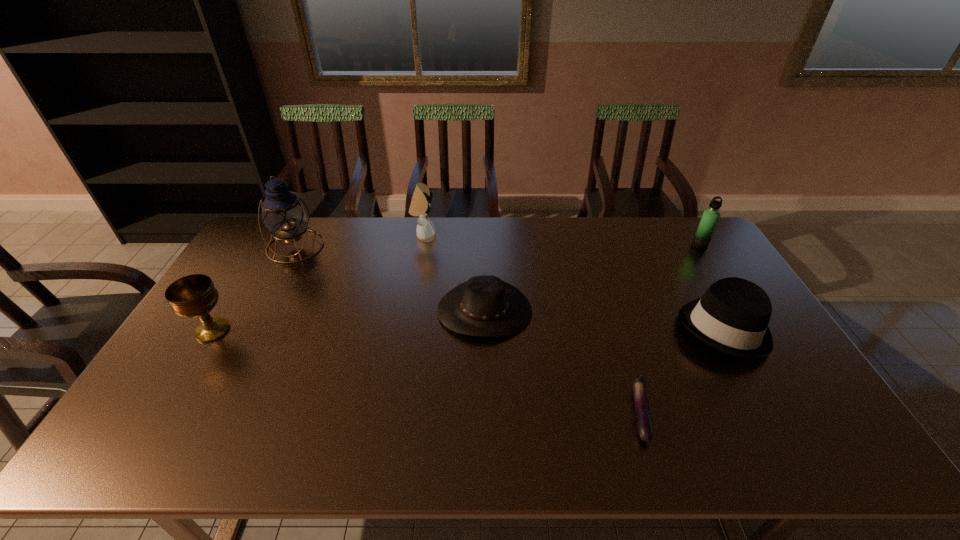
Identify the location of lantern located at the left edge. (284, 214).

In order to click on chalice located at the left edge in this screenshot , I will do `click(194, 296)`.

Image resolution: width=960 pixels, height=540 pixels. Identify the location of thermos bottle that is at the right edge. (710, 217).

I want to click on fedora present at the right edge, so click(x=732, y=316).

Find the location of a particular element. The height and width of the screenshot is (540, 960). object located at the far left corner is located at coordinates (284, 214).

This screenshot has width=960, height=540. I want to click on object located at the far right corner, so click(710, 217).

You are a GUI agent. You are given a task and a screenshot of the screen. Output one action in this format:
    pyautogui.click(x=<x>, y=<y>)
    Task: Click on the vacant space at the far edge of the desktop
    The width and height of the screenshot is (960, 540).
    Given the screenshot: What is the action you would take?
    pyautogui.click(x=506, y=225)

This screenshot has width=960, height=540. Find the location of `vacant area at the near edge`. vacant area at the near edge is located at coordinates (492, 443).

The image size is (960, 540). In the image, there is a desktop. Identify the location of vacant region at the left edge. (177, 371).

Locate an element on the screen. vacant space at the far left corner of the desktop is located at coordinates (264, 233).